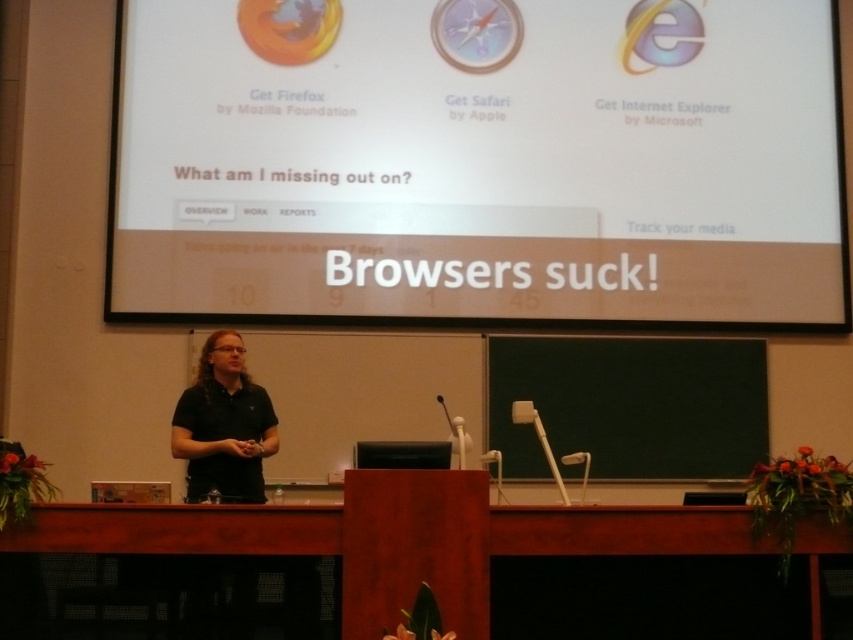
Question: Which point appears farthest from the camera in this image?

Choices:
 (A) (207, 400)
 (B) (451, 196)

Answer: (B)

Question: Is white text on projector screen at upper center positioned behind black matte shirt at center?

Choices:
 (A) yes
 (B) no

Answer: (A)

Question: Which of the following is the farthest from the observer?

Choices:
 (A) (476, 272)
 (B) (236, 413)

Answer: (A)

Question: Does white text on projector screen at upper center have a larger size compared to black matte shirt at center?

Choices:
 (A) yes
 (B) no

Answer: (A)

Question: Can you confirm if white text on projector screen at upper center is wider than black matte shirt at center?

Choices:
 (A) no
 (B) yes

Answer: (B)